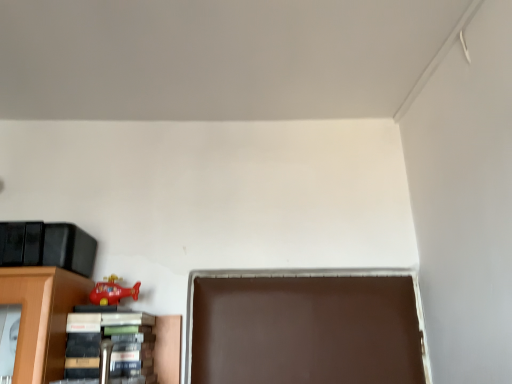
Question: Considering the relative positions of rubber red helicopter at lower left and hardcover book at lower left in the image provided, is rubber red helicopter at lower left to the right of hardcover book at lower left from the viewer's perspective?

Choices:
 (A) yes
 (B) no

Answer: (B)

Question: Would you say rubber red helicopter at lower left contains hardcover book at lower left?

Choices:
 (A) no
 (B) yes

Answer: (A)

Question: Is rubber red helicopter at lower left placed right next to hardcover book at lower left?

Choices:
 (A) yes
 (B) no

Answer: (B)

Question: From the image's perspective, would you say rubber red helicopter at lower left is positioned over hardcover book at lower left?

Choices:
 (A) no
 (B) yes

Answer: (B)

Question: Does rubber red helicopter at lower left come in front of hardcover book at lower left?

Choices:
 (A) no
 (B) yes

Answer: (A)

Question: Is rubber red helicopter at lower left wider than hardcover book at lower left?

Choices:
 (A) yes
 (B) no

Answer: (B)

Question: From a real-world perspective, does hardcover book at lower left stand above rubber red helicopter at lower left?

Choices:
 (A) yes
 (B) no

Answer: (B)

Question: Can you confirm if hardcover book at lower left is thinner than rubber red helicopter at lower left?

Choices:
 (A) no
 (B) yes

Answer: (A)

Question: Is hardcover book at lower left oriented away from rubber red helicopter at lower left?

Choices:
 (A) no
 (B) yes

Answer: (A)

Question: Considering the relative sizes of hardcover book at lower left and rubber red helicopter at lower left in the image provided, is hardcover book at lower left shorter than rubber red helicopter at lower left?

Choices:
 (A) no
 (B) yes

Answer: (A)

Question: Considering the relative positions of hardcover book at lower left and rubber red helicopter at lower left in the image provided, is hardcover book at lower left to the left of rubber red helicopter at lower left from the viewer's perspective?

Choices:
 (A) no
 (B) yes

Answer: (A)

Question: Can you confirm if hardcover book at lower left is positioned to the right of rubber red helicopter at lower left?

Choices:
 (A) yes
 (B) no

Answer: (A)

Question: From a real-world perspective, is rubber red helicopter at lower left positioned above or below hardcover book at lower left?

Choices:
 (A) above
 (B) below

Answer: (A)